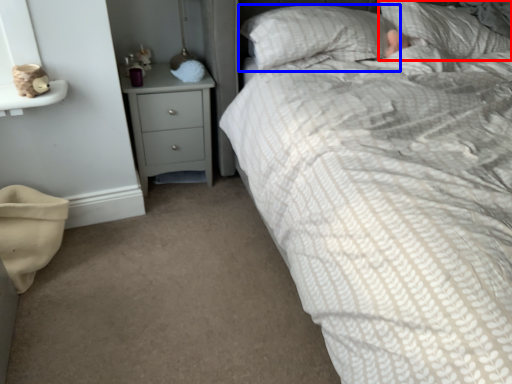
Question: Which of the following is the farthest to the observer, pillow (highlighted by a red box) or pillow (highlighted by a blue box)?

Choices:
 (A) pillow
 (B) pillow

Answer: (A)